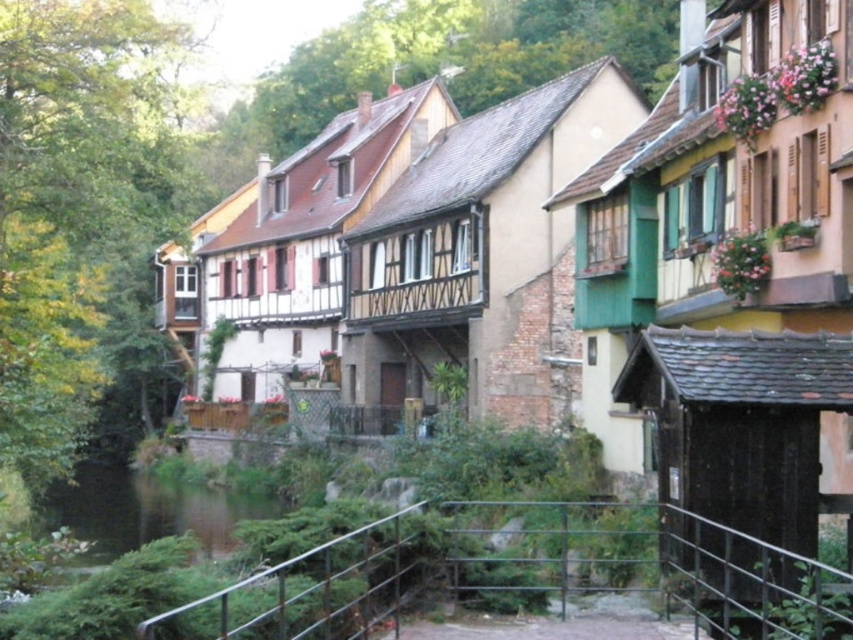
This screenshot has width=853, height=640. What do you see at coordinates (531, 572) in the screenshot?
I see `metal/rusty rail at lower center` at bounding box center [531, 572].

Is point (251, 582) farther from camera compared to point (96, 467)?

No.

Identify the location of metal/rusty rail at lower center. This screenshot has height=640, width=853. (531, 572).